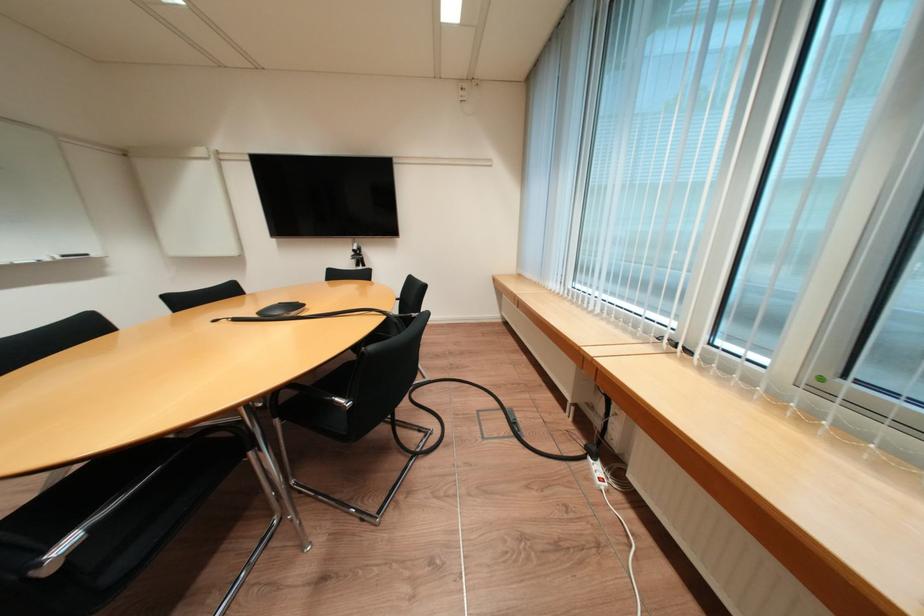
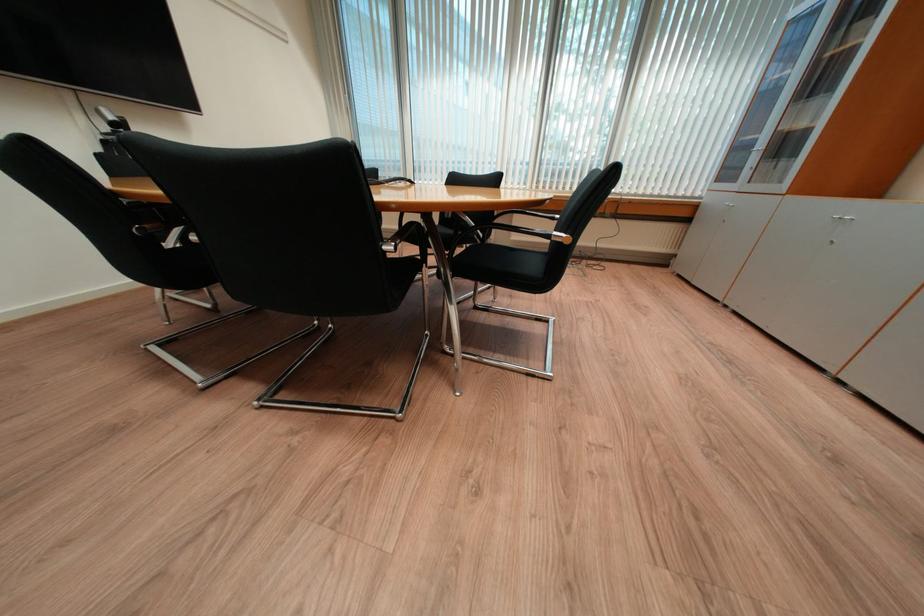
Question: I am providing you with two images of the same scene from different viewpoints. Please identify which objects are invisible in image2.

Choices:
 (A) cabinet door handle
 (B) black chair sitting surface
 (C) metal chair armrest
 (D) pink hairdryer

Answer: (B)